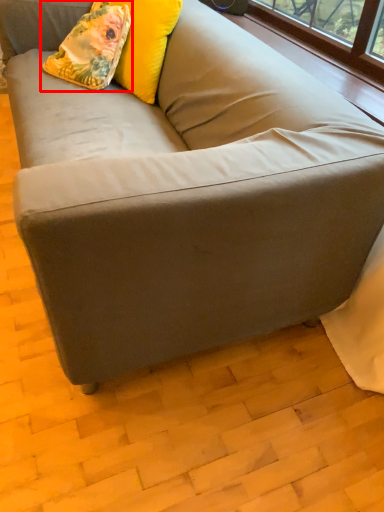
Question: From the image's perspective, considering the relative positions of throw pillow (annotated by the red box) and pillow in the image provided, where is throw pillow (annotated by the red box) located with respect to the staircase?

Choices:
 (A) above
 (B) below

Answer: (B)